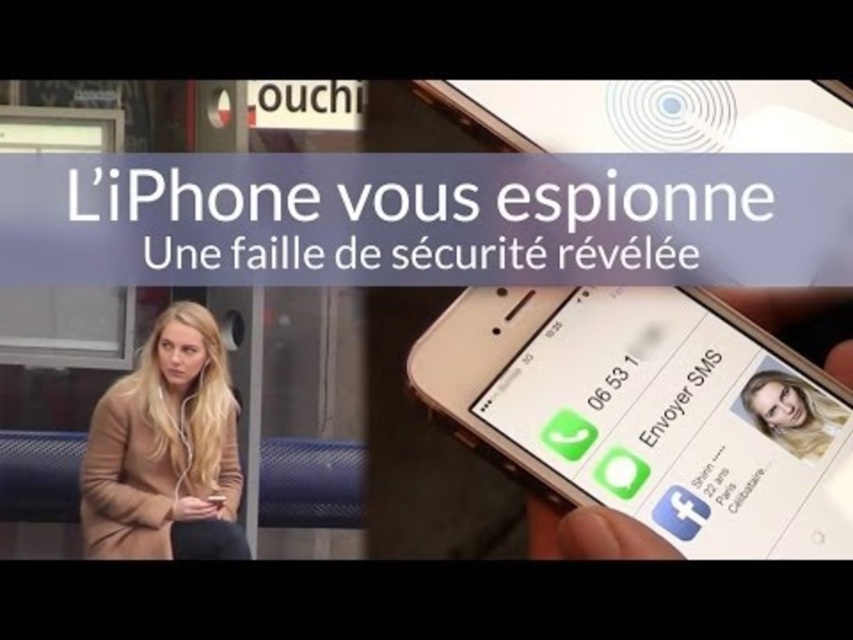
Question: Among these objects, which one is nearest to the camera?

Choices:
 (A) blonde hair at upper right
 (B) camel wool coat at left
 (C) white glossy text message at center

Answer: (A)

Question: Which point is farther to the camera?

Choices:
 (A) white paper text at upper center
 (B) blonde hair at upper right
 (C) camel wool coat at left

Answer: (C)

Question: Where is white paper text at upper center located in relation to blonde hair at upper right in the image?

Choices:
 (A) left
 (B) right

Answer: (A)

Question: Does gold metallic smartphone at center come behind white paper text at upper center?

Choices:
 (A) no
 (B) yes

Answer: (A)

Question: Does blonde hair at upper right have a lesser width compared to white glossy text message at center?

Choices:
 (A) no
 (B) yes

Answer: (A)

Question: Which point is closer to the camera?

Choices:
 (A) (639, 387)
 (B) (389, 257)
 (C) (183, 444)

Answer: (A)